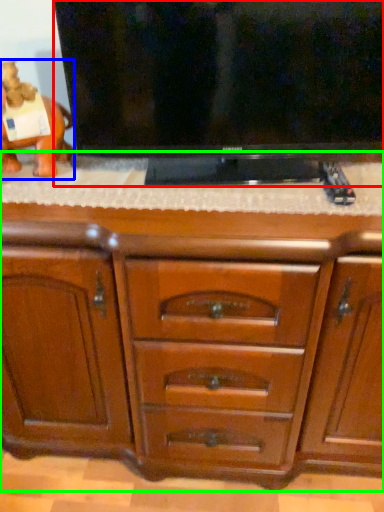
Question: Which object is the farthest from television (highlighted by a red box)? Choose among these: animal (highlighted by a blue box) or chest of drawers (highlighted by a green box).

Choices:
 (A) animal
 (B) chest of drawers

Answer: (A)